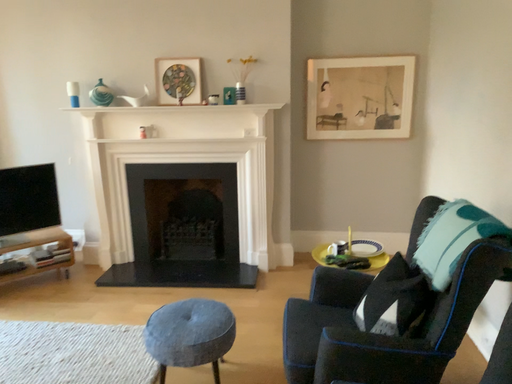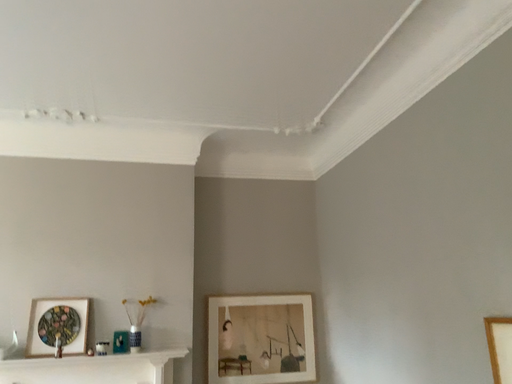
Question: How did the camera likely rotate when shooting the video?

Choices:
 (A) rotated left
 (B) rotated right

Answer: (B)